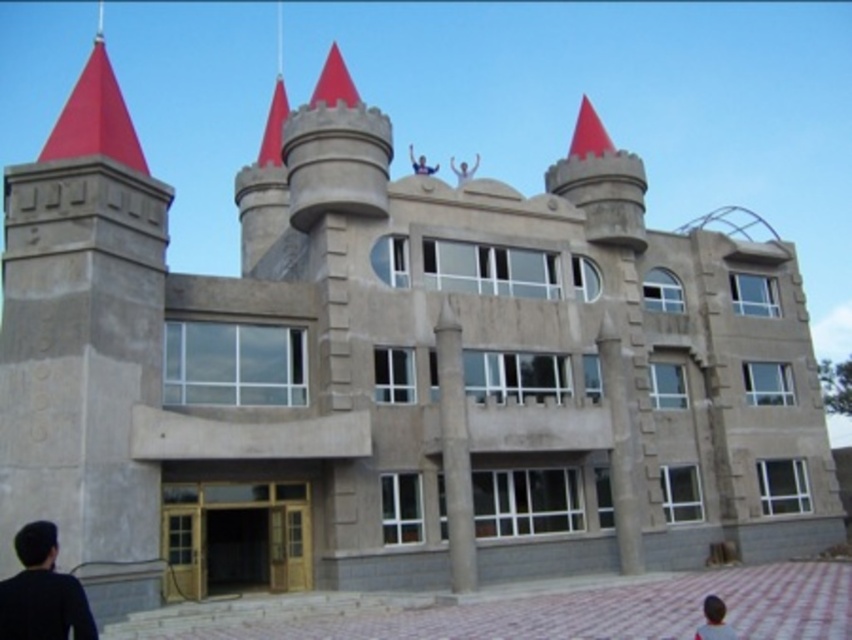
You are a visitor approaching the whimsical castle building. You see a white matte head at lower right and a smooth skin person at upper center in your view. Which object is closer to you?

The white matte head at lower right is closer to you because it is shorter than the smooth skin person at upper center, meaning it appears lower in your field of view.

You are a photographer setting up equipment in front of the building. You have a camera that can only focus on objects within a 1.2 meter width. You see the black matte shirt at lower left and the white matte head at lower right. Can you focus on both objects simultaneously without moving the camera?

The black matte shirt at lower left might be wider than white matte head at lower right. Since the total width of both objects combined could exceed 1.2 meters, it is uncertain if the camera can focus on both simultaneously without moving.

Based on the photo, you are standing in front of the castle building and notice a white matte head at lower right. Where exactly is this head positioned relative to the building?

The white matte head at lower right is positioned at coordinates point [714,620] relative to the building.